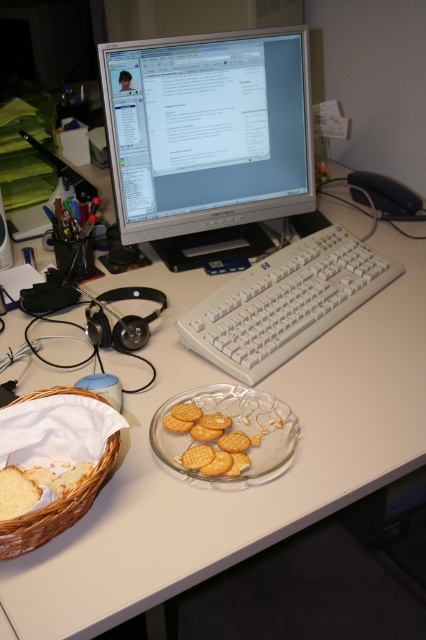
Question: Which point is farther from the camera taking this photo?

Choices:
 (A) (362, 252)
 (B) (115, 445)
 (C) (146, 188)
 (D) (213, 422)

Answer: (A)

Question: Does satin silver monitor at upper center appear under woven brown basket at lower left?

Choices:
 (A) no
 (B) yes

Answer: (A)

Question: Which object appears closest to the camera in this image?

Choices:
 (A) golden crisp crackers at center
 (B) woven brown basket at lower left

Answer: (B)

Question: Considering the real-world distances, which object is farthest from the satin silver monitor at upper center?

Choices:
 (A) golden crisp crackers at center
 (B) white plastic keyboard at center

Answer: (A)

Question: Is the position of white plastic keyboard at center less distant than that of woven brown basket at lower left?

Choices:
 (A) no
 (B) yes

Answer: (A)

Question: Is white plastic keyboard at center wider than woven brown basket at lower left?

Choices:
 (A) yes
 (B) no

Answer: (A)